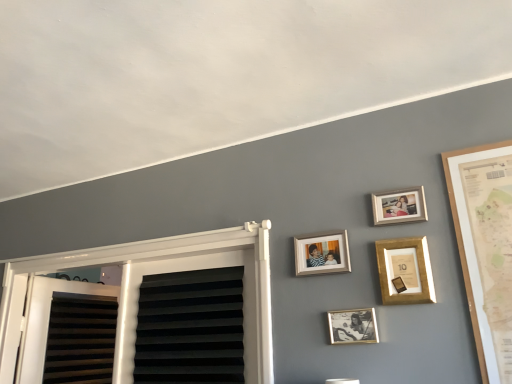
Question: Is wooden photo frame at upper right, acting as the first picture frame starting from the top, inside the boundaries of wooden photo frame at center, placed as the 3th picture frame when sorted from bottom to top, or outside?

Choices:
 (A) inside
 (B) outside

Answer: (B)

Question: Looking at their shapes, would you say wooden photo frame at upper right, placed as the 4th picture frame when sorted from bottom to top, is wider or thinner than wooden photo frame at center, the 2th picture frame when ordered from top to bottom?

Choices:
 (A) thin
 (B) wide

Answer: (A)

Question: Which of these objects is positioned closest to the gold-framed photo at center, arranged as the 4th picture frame when viewed from the top?

Choices:
 (A) gold metallic picture frame at upper center, which is counted as the third picture frame, starting from the top
 (B) wooden photo frame at upper right, placed as the 4th picture frame when sorted from bottom to top
 (C) wooden photo frame at center, the 2th picture frame when ordered from top to bottom

Answer: (A)

Question: Which object is the farthest from the gold-framed photo at center, arranged as the 4th picture frame when viewed from the top?

Choices:
 (A) wooden photo frame at upper right, placed as the 4th picture frame when sorted from bottom to top
 (B) wooden photo frame at center, placed as the 3th picture frame when sorted from bottom to top
 (C) gold metallic picture frame at upper center, acting as the second picture frame starting from the bottom

Answer: (A)